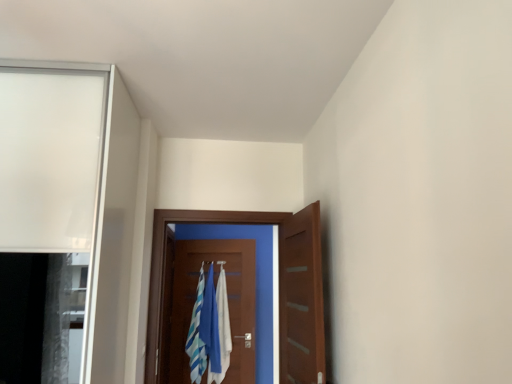
Question: Is wooden door at center, positioned as the 2th door in back-to-front order, smaller than wooden door at center, the 3th door when ordered from back to front?

Choices:
 (A) no
 (B) yes

Answer: (B)

Question: Could you tell me if wooden door at center, positioned as the 2th door in back-to-front order, is turned towards wooden door at center, the 3th door when ordered from back to front?

Choices:
 (A) yes
 (B) no

Answer: (A)

Question: From the image's perspective, would you say wooden door at center, positioned as the 2th door in back-to-front order, is shown under wooden door at center, the 3th door when ordered from back to front?

Choices:
 (A) no
 (B) yes

Answer: (B)

Question: Does wooden door at center, which ranks as the 2th door in front-to-back order, have a lesser width compared to wooden door at center, the first door from the front?

Choices:
 (A) yes
 (B) no

Answer: (A)

Question: Is wooden door at center, which ranks as the 2th door in front-to-back order, looking in the opposite direction of wooden door at center, the 3th door when ordered from back to front?

Choices:
 (A) yes
 (B) no

Answer: (B)

Question: From the image's perspective, is wooden door at center, positioned as the 2th door in back-to-front order, over wooden door at center, the first door from the front?

Choices:
 (A) no
 (B) yes

Answer: (A)

Question: From the image's perspective, is blue fabric laundry at center beneath white cotton bath towel at center?

Choices:
 (A) yes
 (B) no

Answer: (A)

Question: Is blue fabric laundry at center positioned far away from white cotton bath towel at center?

Choices:
 (A) no
 (B) yes

Answer: (A)

Question: Is blue fabric laundry at center closer to camera compared to white cotton bath towel at center?

Choices:
 (A) no
 (B) yes

Answer: (A)

Question: From a real-world perspective, is blue fabric laundry at center physically above white cotton bath towel at center?

Choices:
 (A) no
 (B) yes

Answer: (A)

Question: From a real-world perspective, is blue fabric laundry at center under white cotton bath towel at center?

Choices:
 (A) no
 (B) yes

Answer: (B)

Question: Can you confirm if blue fabric laundry at center is wider than white cotton bath towel at center?

Choices:
 (A) no
 (B) yes

Answer: (B)

Question: Is blue fabric laundry at center positioned before wooden door at center, which is counted as the 1th door, starting from the back?

Choices:
 (A) yes
 (B) no

Answer: (B)